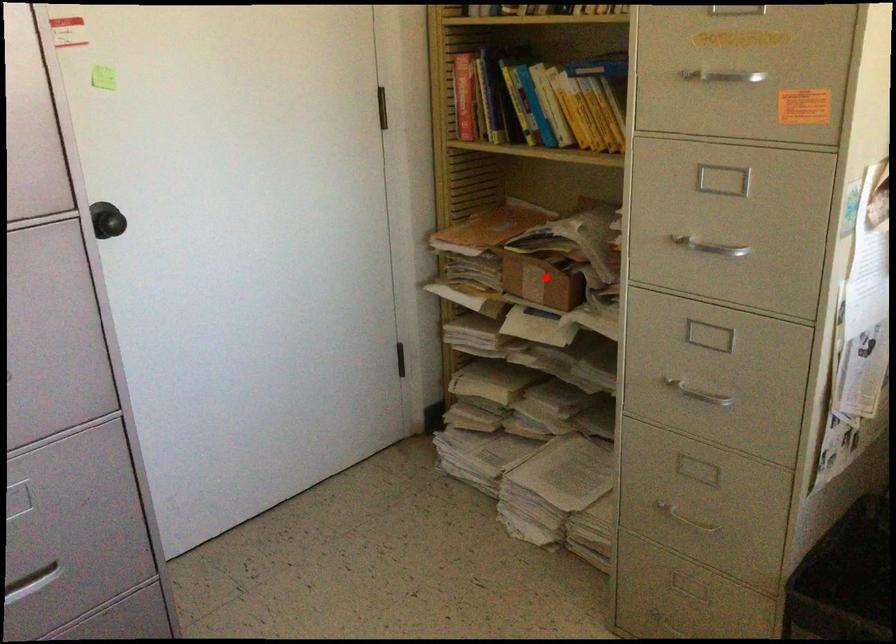
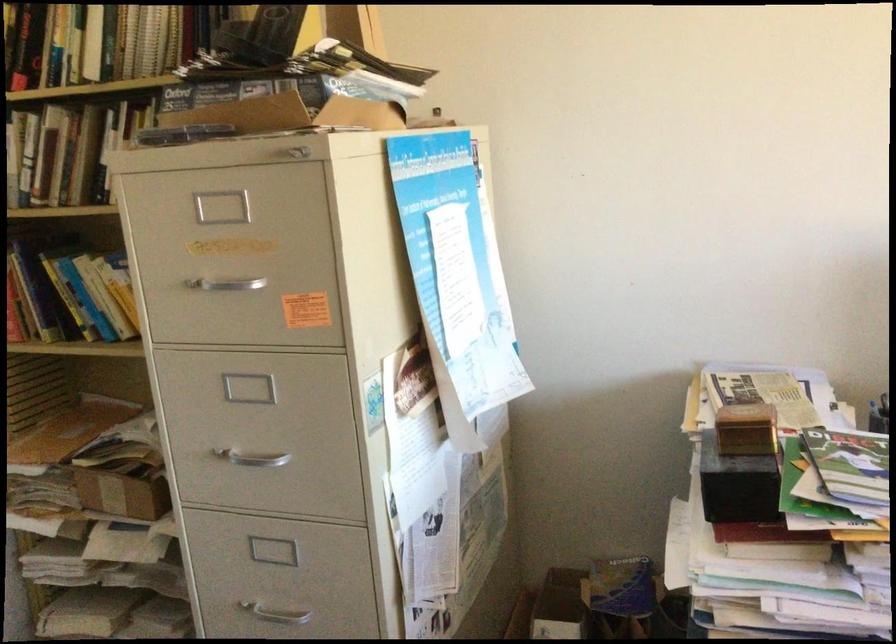
Locate, in the second image, the point that corresponds to the highlighted location in the first image.

(123, 488)